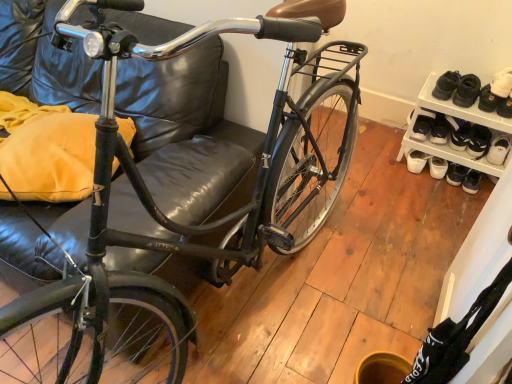
Question: Considering the relative sizes of white suede shoe at upper right and white leather shoe at upper right, which is the second footwear in left-to-right order, in the image provided, is white suede shoe at upper right taller than white leather shoe at upper right, which is the second footwear in left-to-right order,?

Choices:
 (A) yes
 (B) no

Answer: (A)

Question: Does white suede shoe at upper right appear on the left side of white leather shoe at upper right, the first footwear from the right?

Choices:
 (A) no
 (B) yes

Answer: (B)

Question: Can you confirm if white suede shoe at upper right is wider than white leather shoe at upper right, which is the second footwear in left-to-right order?

Choices:
 (A) yes
 (B) no

Answer: (B)

Question: Is white suede shoe at upper right oriented away from white leather shoe at upper right, which is the second footwear in left-to-right order?

Choices:
 (A) yes
 (B) no

Answer: (B)

Question: Is white suede shoe at upper right at the right side of white leather shoe at upper right, which is the second footwear in left-to-right order?

Choices:
 (A) yes
 (B) no

Answer: (B)

Question: Is point (340, 158) positioned closer to the camera than point (496, 124)?

Choices:
 (A) closer
 (B) farther

Answer: (A)

Question: Is shiny black bicycle at center wider or thinner than white mesh shoe rack at lower right?

Choices:
 (A) wide
 (B) thin

Answer: (A)

Question: From a real-world perspective, is shiny black bicycle at center above or below white mesh shoe rack at lower right?

Choices:
 (A) above
 (B) below

Answer: (A)

Question: Which is correct: shiny black bicycle at center is inside white mesh shoe rack at lower right, or outside of it?

Choices:
 (A) inside
 (B) outside

Answer: (B)

Question: Choose the correct answer: Is white matte shoe at right, which is the second footwear in right-to-left order, inside shiny black bicycle at center or outside it?

Choices:
 (A) inside
 (B) outside

Answer: (B)

Question: From a real-world perspective, is white matte shoe at right, which is the second footwear in right-to-left order, above or below shiny black bicycle at center?

Choices:
 (A) below
 (B) above

Answer: (A)

Question: Is white matte shoe at right, arranged as the first footwear when viewed from the left, in front of or behind shiny black bicycle at center in the image?

Choices:
 (A) behind
 (B) front

Answer: (A)

Question: Is point (419, 132) positioned closer to the camera than point (97, 170)?

Choices:
 (A) closer
 (B) farther

Answer: (B)

Question: In terms of height, does white suede shoe at upper right look taller or shorter compared to shiny black bicycle at center?

Choices:
 (A) tall
 (B) short

Answer: (B)

Question: In the image, is white suede shoe at upper right positioned in front of or behind shiny black bicycle at center?

Choices:
 (A) front
 (B) behind

Answer: (B)